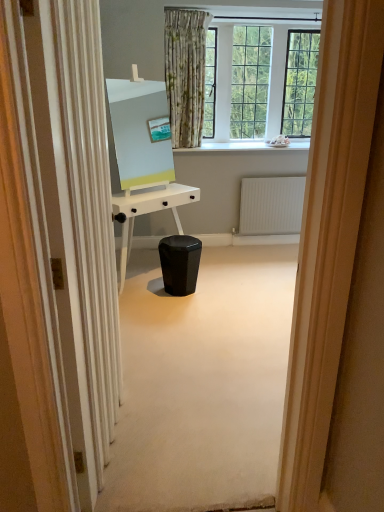
Question: Is black glossy music stool at center taller than white glossy desk at center?

Choices:
 (A) no
 (B) yes

Answer: (A)

Question: Can you confirm if black glossy music stool at center is bigger than white glossy desk at center?

Choices:
 (A) no
 (B) yes

Answer: (A)

Question: Is black glossy music stool at center outside white glossy desk at center?

Choices:
 (A) no
 (B) yes

Answer: (B)

Question: Is black glossy music stool at center smaller than white glossy desk at center?

Choices:
 (A) yes
 (B) no

Answer: (A)

Question: Does black glossy music stool at center have a lesser height compared to white glossy desk at center?

Choices:
 (A) no
 (B) yes

Answer: (B)

Question: Is white textured radiator at center spatially inside white glossy desk at center, or outside of it?

Choices:
 (A) inside
 (B) outside

Answer: (B)

Question: Is white textured radiator at center bigger or smaller than white glossy desk at center?

Choices:
 (A) small
 (B) big

Answer: (A)

Question: From the image's perspective, is white textured radiator at center positioned above or below white glossy desk at center?

Choices:
 (A) below
 (B) above

Answer: (B)

Question: Considering their positions, is white textured radiator at center located in front of or behind white glossy desk at center?

Choices:
 (A) behind
 (B) front

Answer: (A)

Question: Is point coord(266,196) closer or farther from the camera than point coord(130,99)?

Choices:
 (A) farther
 (B) closer

Answer: (A)

Question: Is white textured radiator at center spatially inside matte white easel at center, or outside of it?

Choices:
 (A) outside
 (B) inside

Answer: (A)

Question: Is white textured radiator at center in front of or behind matte white easel at center in the image?

Choices:
 (A) behind
 (B) front

Answer: (A)

Question: From a real-world perspective, is white textured radiator at center physically located above or below matte white easel at center?

Choices:
 (A) above
 (B) below

Answer: (B)

Question: From a real-world perspective, is matte white easel at center physically located above or below black glossy music stool at center?

Choices:
 (A) above
 (B) below

Answer: (A)

Question: Is matte white easel at center in front of or behind black glossy music stool at center in the image?

Choices:
 (A) behind
 (B) front

Answer: (B)